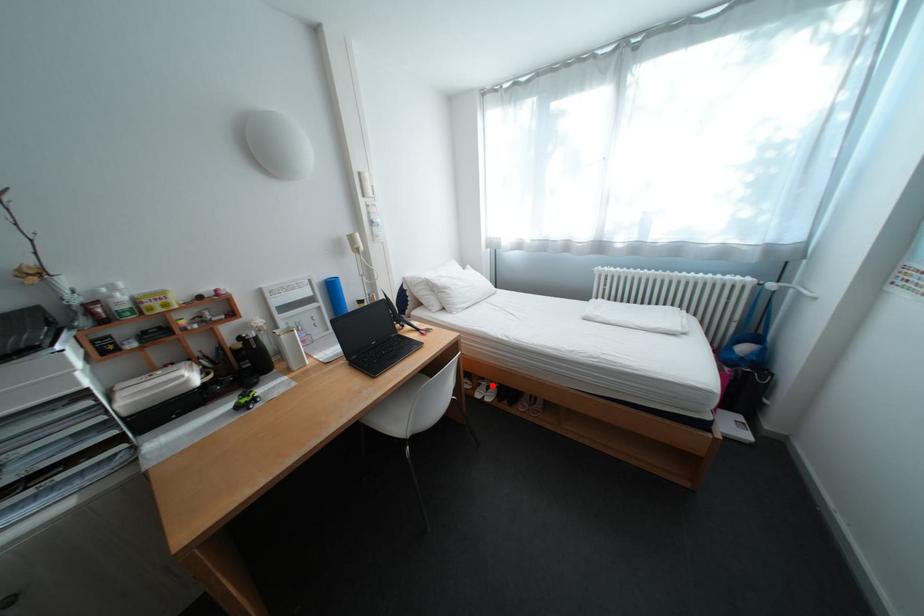
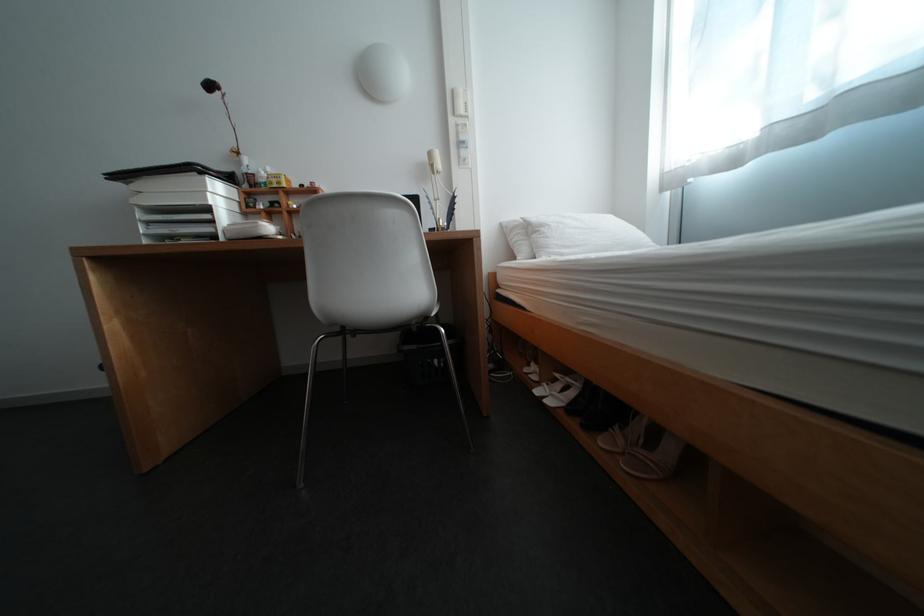
Question: I am providing you with two images of the same scene from different viewpoints. A red point is shown in image1. For the corresponding object point in image2, is it positioned nearer or farther from the camera?

Choices:
 (A) Nearer
 (B) Farther

Answer: (A)